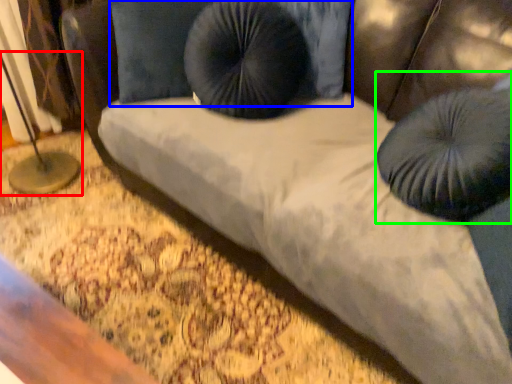
Question: Which is nearer to the table lamp (highlighted by a red box)? pillow (highlighted by a blue box) or bean bag chair (highlighted by a green box).

Choices:
 (A) pillow
 (B) bean bag chair

Answer: (A)